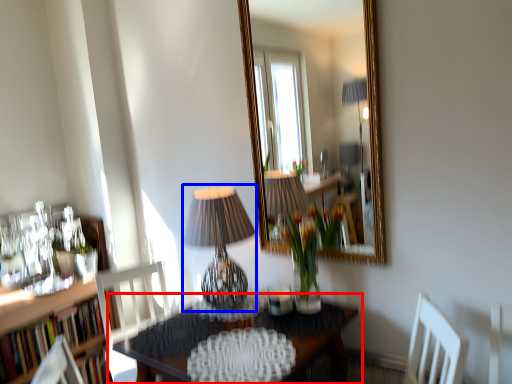
Question: Among these objects, which one is nearest to the camera, table (highlighted by a red box) or table lamp (highlighted by a blue box)?

Choices:
 (A) table
 (B) table lamp

Answer: (A)